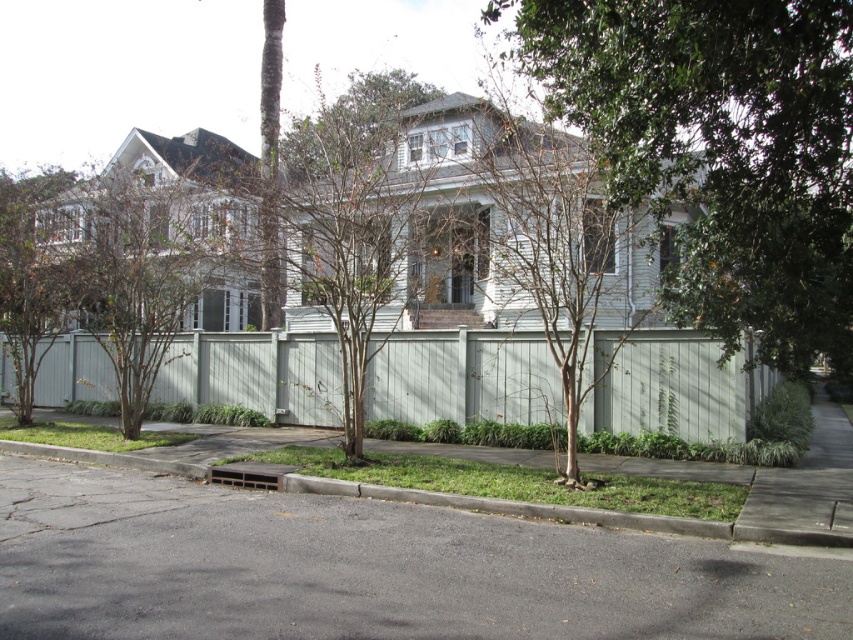
Question: Is green leafy tree at center closer to camera compared to gray concrete curb at lower center?

Choices:
 (A) yes
 (B) no

Answer: (A)

Question: Which object is positioned farthest from the brown textured tree at left?

Choices:
 (A) brown leafy tree at center
 (B) light gray wood fence at center
 (C) gray concrete curb at lower center

Answer: (C)

Question: Which of the following is the closest to the observer?

Choices:
 (A) gray concrete curb at lower center
 (B) light gray wood fence at center
 (C) brown leafy tree at center

Answer: (A)

Question: Does brown textured tree at center lie behind gray concrete curb at lower center?

Choices:
 (A) no
 (B) yes

Answer: (B)

Question: Which of these objects is positioned farthest from the brown leafy tree at center?

Choices:
 (A) gray concrete curb at lower center
 (B) brown textured tree at center

Answer: (B)

Question: Is brown textured tree at left to the left of gray concrete curb at lower center from the viewer's perspective?

Choices:
 (A) yes
 (B) no

Answer: (A)